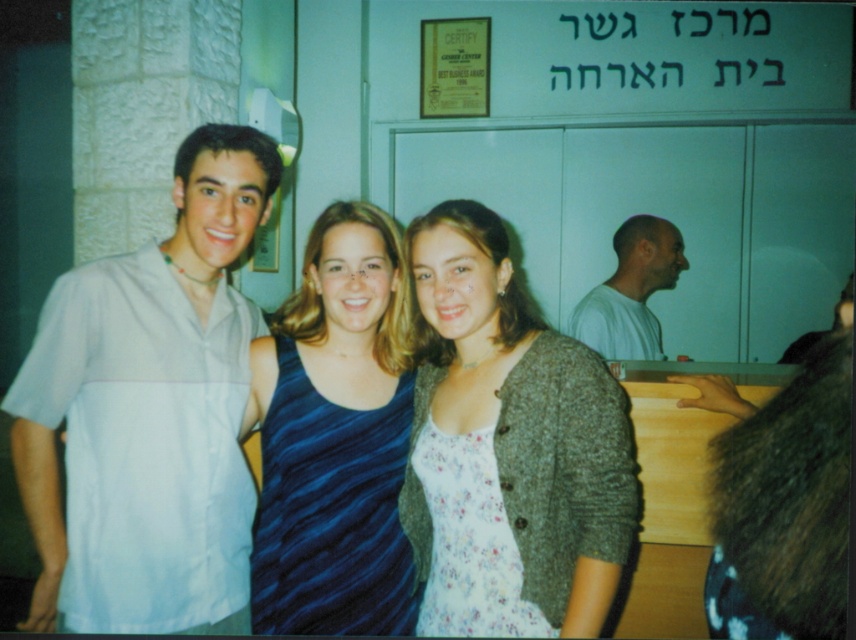
You are organizing a clothing donation drive and need to determine which of the two items, the blue striped tank top at center or the white cotton shirt at right, can fit into a standard donation box that has a width capacity of 40 cm. Based on their sizes, which one is more likely to fit without folding?

The blue striped tank top at center has a lesser width compared to the white cotton shirt at right, so it is more likely to fit into the donation box without folding.